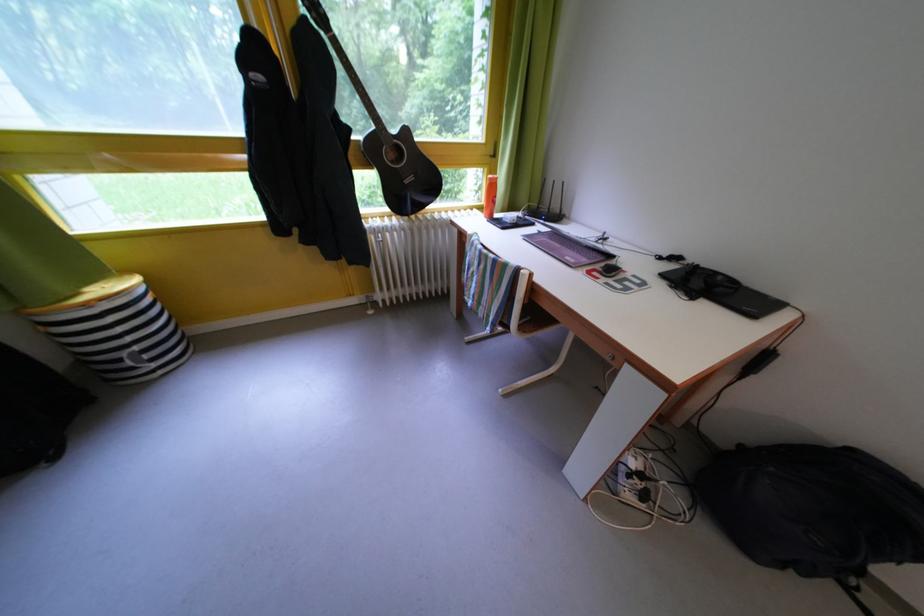
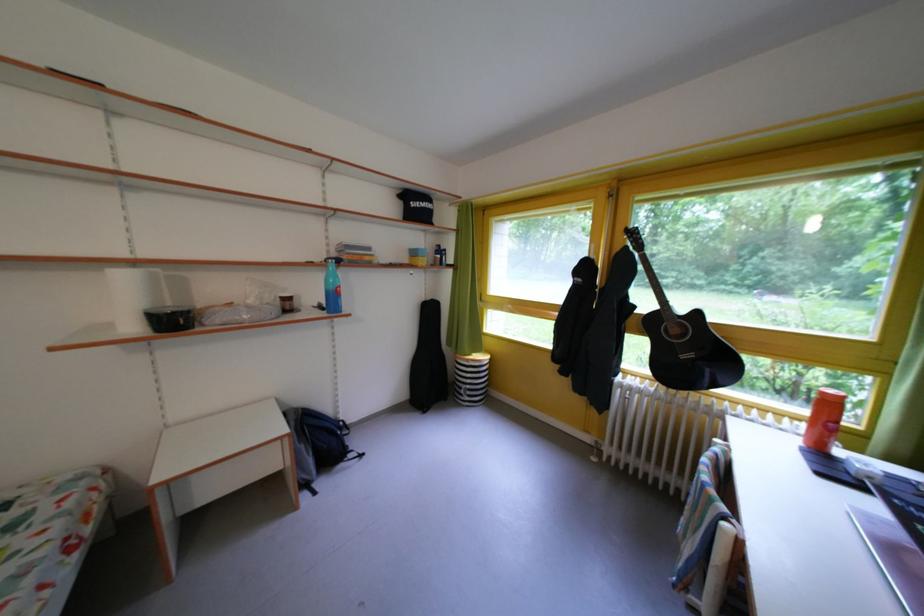
The point at (x=500, y=185) is marked in the first image. Where is the corresponding point in the second image?

(833, 399)